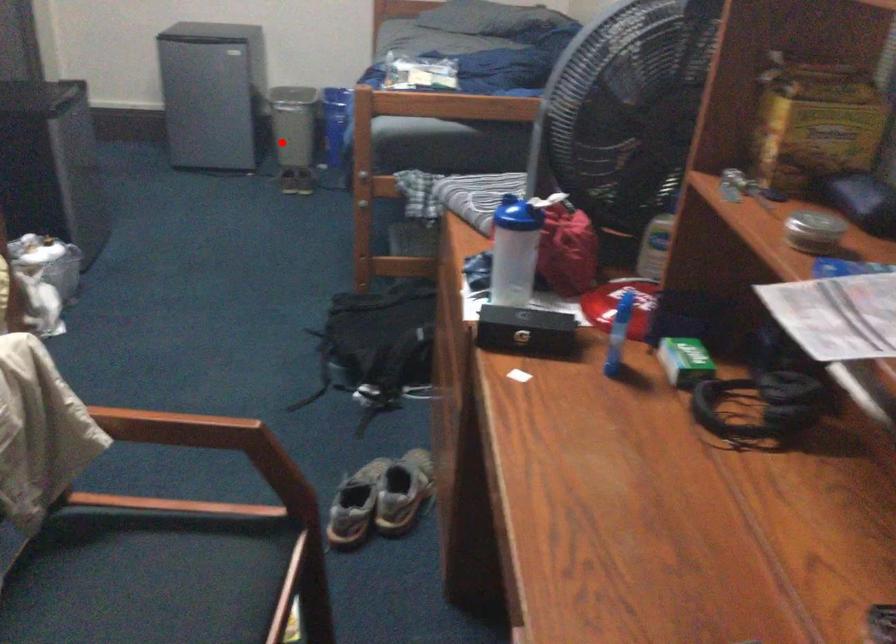
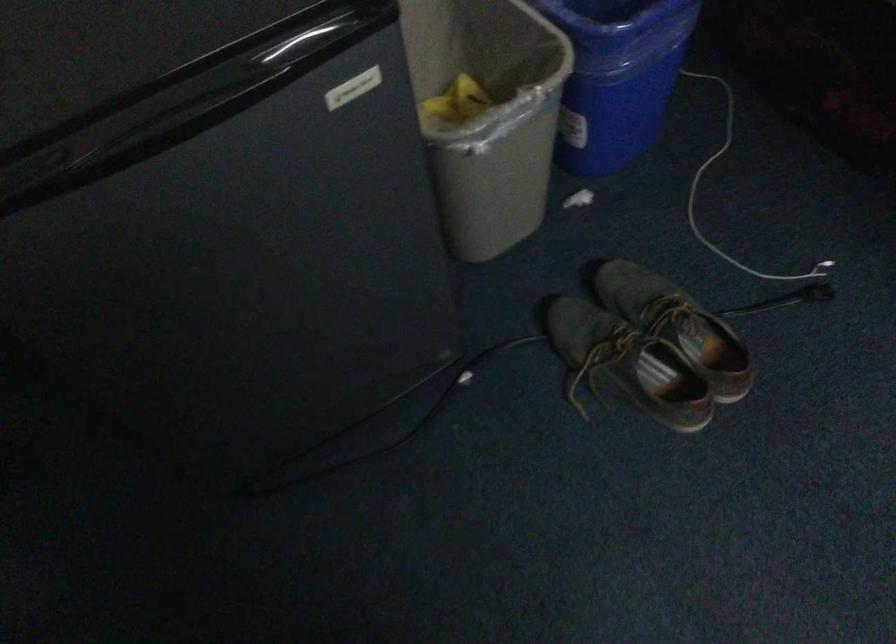
Question: I am providing you with two images of the same scene from different viewpoints. Given a red point in image1, look at the same physical point in image2. Is it:

Choices:
 (A) Closer to the viewpoint
 (B) Farther from the viewpoint

Answer: (A)